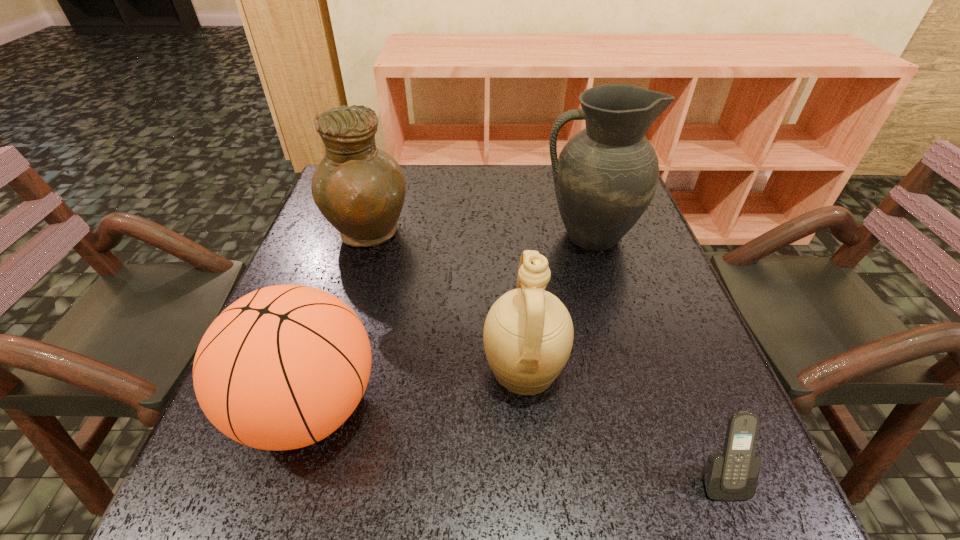
The image size is (960, 540). I want to click on vacant region at the right edge, so click(631, 362).

The height and width of the screenshot is (540, 960). I want to click on free space at the near left corner of the desktop, so click(x=289, y=503).

Locate an element on the screen. Image resolution: width=960 pixels, height=540 pixels. free space between the nearest pitcher and the cellular telephone is located at coordinates (622, 423).

This screenshot has width=960, height=540. I want to click on the third closest object to the shortest pitcher, so click(x=607, y=174).

Identify the location of the fourth closest object relative to the basketball. click(x=733, y=475).

Where is `pitcher that stands as the third closest to the basketball`? pitcher that stands as the third closest to the basketball is located at coordinates (607, 174).

Where is `the closest pitcher to the basketball`? The height and width of the screenshot is (540, 960). the closest pitcher to the basketball is located at coordinates (528, 334).

Where is `vacant space that satisfies the following two spatial constraints: 1. at the spout of the leftmost pitcher; 2. on the right side of the nearest pitcher`? The width and height of the screenshot is (960, 540). vacant space that satisfies the following two spatial constraints: 1. at the spout of the leftmost pitcher; 2. on the right side of the nearest pitcher is located at coordinates (326, 369).

Locate an element on the screen. This screenshot has height=540, width=960. free space that satisfies the following two spatial constraints: 1. at the spout of the nearest pitcher; 2. on the left side of the leftmost pitcher is located at coordinates (326, 369).

You are a GUI agent. You are given a task and a screenshot of the screen. Output one action in this format:
    pyautogui.click(x=<x>, y=<y>)
    Task: Click on the free location that satisfies the following two spatial constraints: 1. at the spout of the leftmost pitcher; 2. on the right side of the shortest pitcher
    Image resolution: width=960 pixels, height=540 pixels.
    Given the screenshot: What is the action you would take?
    pyautogui.click(x=326, y=369)